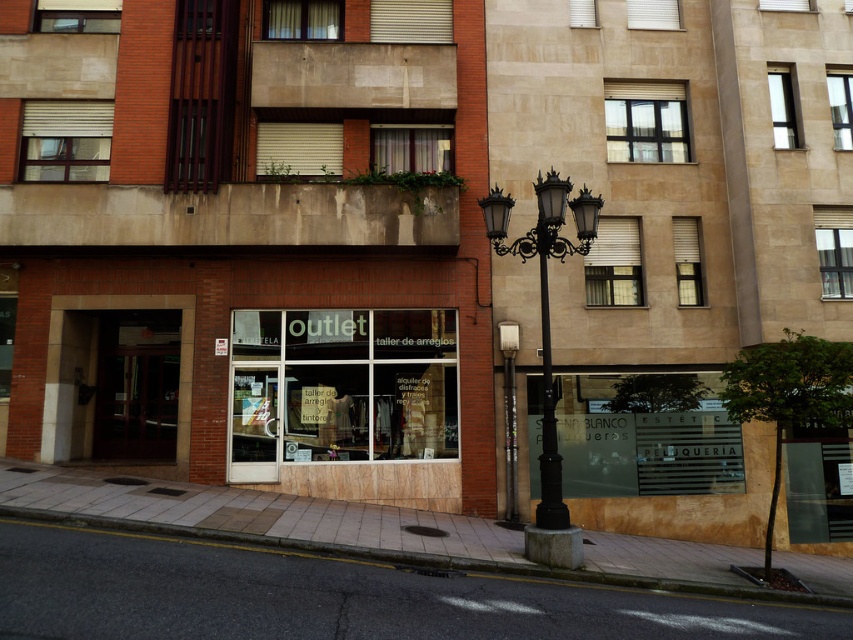
From the picture: You are a delivery driver trying to park your van that is 2 meters wide. You see the transparent glass outlet at center and the gray concrete curb at lower left. Which object is narrower, and can you park between them without hitting either?

The transparent glass outlet at center is thinner than the gray concrete curb at lower left. Since the van is 2 meters wide, you can park between them as the space between them is wider than the van.

You are standing on the street looking at the building. There are two points marked on the building wall. One is at point (596, 204) and the other at point (578, 227). Which point is closer to you?

Point (596, 204) is closer to the camera than point (578, 227), so it is closer to you.